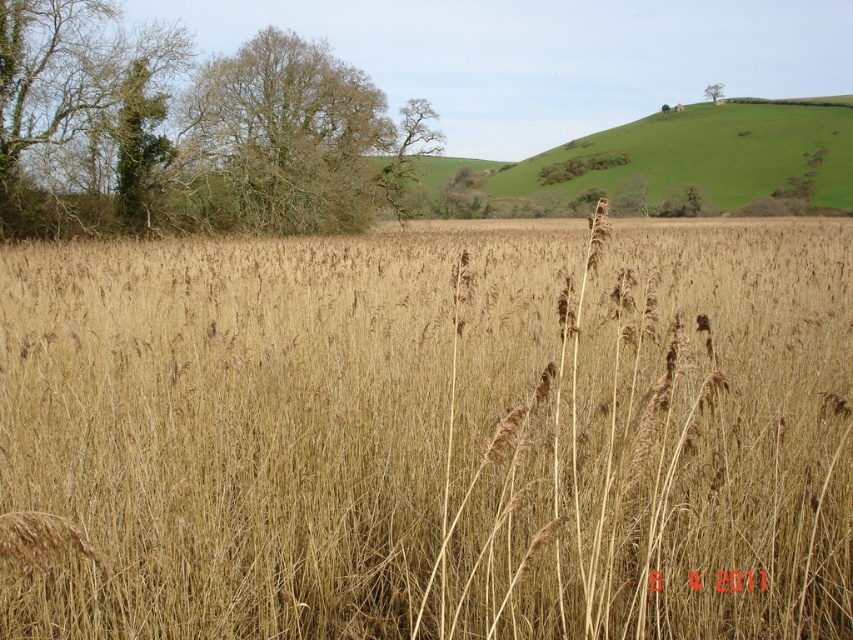
Question: Is bare branches at upper left positioned at the back of green leafy tree at center?

Choices:
 (A) yes
 (B) no

Answer: (B)

Question: Does dry grass at center have a smaller size compared to green leafy tree at upper left?

Choices:
 (A) no
 (B) yes

Answer: (B)

Question: Is dry grass at center positioned before bare branches at upper left?

Choices:
 (A) no
 (B) yes

Answer: (B)

Question: Based on their relative distances, which object is farther from the bare branches at upper left?

Choices:
 (A) green leafy tree at upper right
 (B) dry grass at center
 (C) green leafy tree at upper left

Answer: (A)

Question: Which point is closer to the camera?

Choices:
 (A) dry grass at center
 (B) green leafy tree at upper right
 (C) bare branches at upper left

Answer: (A)

Question: Among these objects, which one is nearest to the camera?

Choices:
 (A) bare branches at upper left
 (B) dry grass at center
 (C) green leafy tree at upper left

Answer: (B)